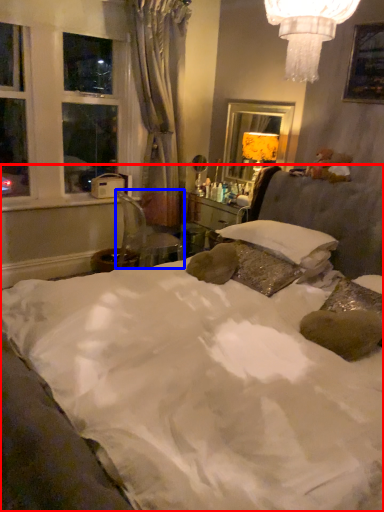
Question: Among these objects, which one is farthest to the camera, bed (highlighted by a red box) or chair (highlighted by a blue box)?

Choices:
 (A) bed
 (B) chair

Answer: (B)